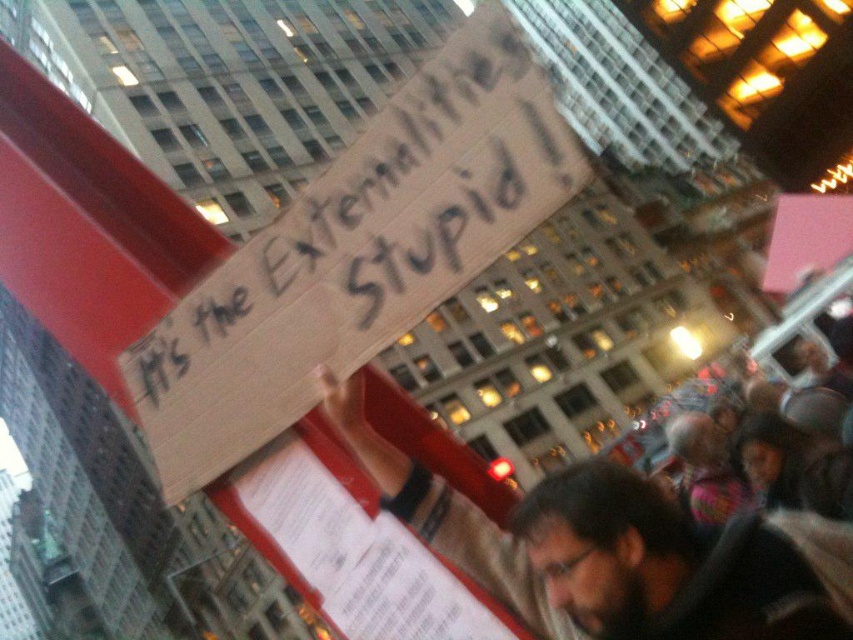
Question: Which object appears farthest from the camera in this image?

Choices:
 (A) handwritten cardboard sign at center
 (B) dark brown hair at center

Answer: (B)

Question: Does handwritten cardboard sign at center have a larger size compared to multicolored knitted hat at lower right?

Choices:
 (A) no
 (B) yes

Answer: (A)

Question: Which point is farther from the camera taking this photo?

Choices:
 (A) (265, 241)
 (B) (648, 621)
 (C) (704, 506)

Answer: (C)

Question: Considering the relative positions of handwritten cardboard sign at center and multicolored knitted hat at lower right in the image provided, where is handwritten cardboard sign at center located with respect to multicolored knitted hat at lower right?

Choices:
 (A) above
 (B) below

Answer: (A)

Question: Can you confirm if dark brown hair at center is thinner than multicolored knitted hat at lower right?

Choices:
 (A) yes
 (B) no

Answer: (B)

Question: Which of the following is the farthest from the observer?

Choices:
 (A) multicolored knitted hat at lower right
 (B) dark brown hair at center
 (C) handwritten cardboard sign at center

Answer: (A)